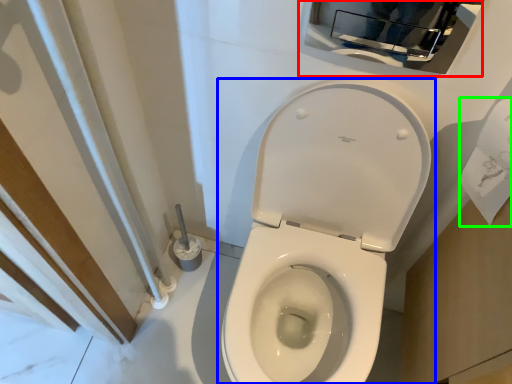
Question: Which object is positioned farthest from medicine cabinet (highlighted by a red box)? Select from toilet (highlighted by a blue box) and toilet paper (highlighted by a green box).

Choices:
 (A) toilet
 (B) toilet paper

Answer: (A)